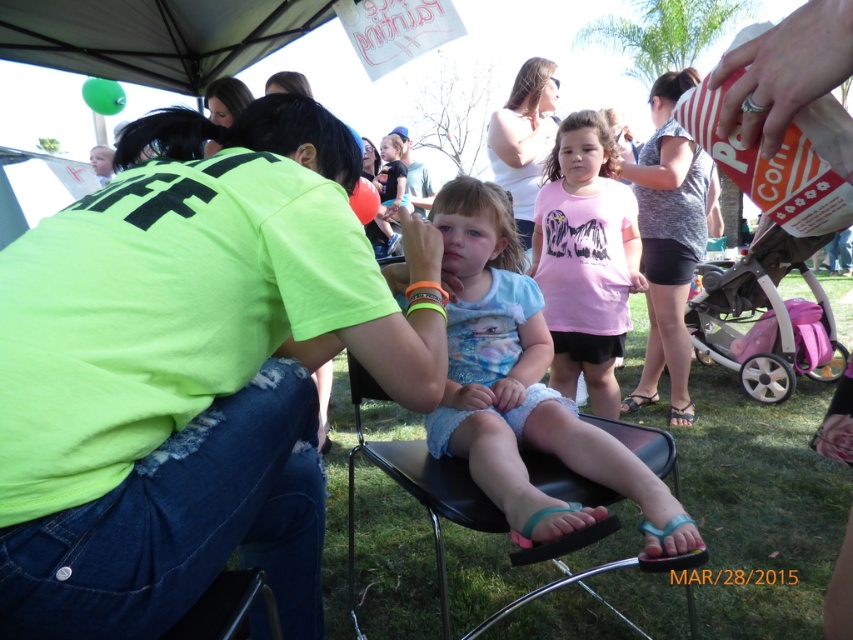
Question: Observing the image, what is the correct spatial positioning of pink fabric baby carriage at right in reference to white matte shirt at upper center?

Choices:
 (A) right
 (B) left

Answer: (A)

Question: Considering the relative positions of gray textured shirt at center and pink fabric baby carriage at right in the image provided, where is gray textured shirt at center located with respect to pink fabric baby carriage at right?

Choices:
 (A) right
 (B) left

Answer: (B)

Question: Which object appears farthest from the camera in this image?

Choices:
 (A) white matte shirt at upper center
 (B) pink fabric baby carriage at right
 (C) pink matte shirt at center
 (D) gray textured shirt at center

Answer: (D)

Question: Can you confirm if light blue denim shorts at center is wider than gray textured shirt at center?

Choices:
 (A) yes
 (B) no

Answer: (B)

Question: Which of these objects is positioned farthest from the pink matte shirt at center?

Choices:
 (A) gray textured shirt at center
 (B) neon green t-shirt at center
 (C) pink fabric baby carriage at right

Answer: (B)

Question: Which object appears closest to the camera in this image?

Choices:
 (A) pink matte shirt at center
 (B) gray textured shirt at center
 (C) pink fabric baby carriage at right
 (D) white matte shirt at upper center

Answer: (D)